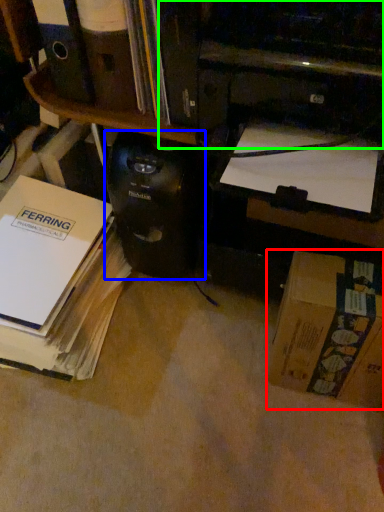
Question: Based on their relative distances, which object is farther from box (highlighted by a red box)? Choose from computer tower (highlighted by a blue box) and printer (highlighted by a green box).

Choices:
 (A) computer tower
 (B) printer

Answer: (B)